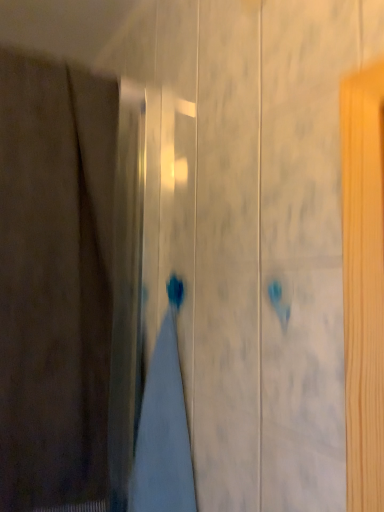
Question: Does brown fabric curtain at left touch gray cotton bath towel at center?

Choices:
 (A) no
 (B) yes

Answer: (A)

Question: Considering the relative sizes of brown fabric curtain at left and gray cotton bath towel at center in the image provided, is brown fabric curtain at left bigger than gray cotton bath towel at center?

Choices:
 (A) no
 (B) yes

Answer: (B)

Question: Is brown fabric curtain at left behind gray cotton bath towel at center?

Choices:
 (A) yes
 (B) no

Answer: (B)

Question: Considering the relative sizes of brown fabric curtain at left and gray cotton bath towel at center in the image provided, is brown fabric curtain at left taller than gray cotton bath towel at center?

Choices:
 (A) no
 (B) yes

Answer: (B)

Question: Can you confirm if brown fabric curtain at left is positioned to the left of gray cotton bath towel at center?

Choices:
 (A) no
 (B) yes

Answer: (B)

Question: Could you tell me if brown fabric curtain at left is turned towards gray cotton bath towel at center?

Choices:
 (A) no
 (B) yes

Answer: (A)

Question: Can you confirm if gray cotton bath towel at center is bigger than brown fabric curtain at left?

Choices:
 (A) no
 (B) yes

Answer: (A)

Question: From a real-world perspective, is gray cotton bath towel at center beneath brown fabric curtain at left?

Choices:
 (A) no
 (B) yes

Answer: (B)

Question: Can you confirm if gray cotton bath towel at center is smaller than brown fabric curtain at left?

Choices:
 (A) yes
 (B) no

Answer: (A)

Question: From the image's perspective, is gray cotton bath towel at center under brown fabric curtain at left?

Choices:
 (A) no
 (B) yes

Answer: (B)

Question: Is the depth of gray cotton bath towel at center greater than that of brown fabric curtain at left?

Choices:
 (A) yes
 (B) no

Answer: (A)

Question: Is gray cotton bath towel at center to the left of brown fabric curtain at left from the viewer's perspective?

Choices:
 (A) no
 (B) yes

Answer: (A)

Question: Looking at the image, does brown fabric curtain at left seem bigger or smaller compared to gray cotton bath towel at center?

Choices:
 (A) small
 (B) big

Answer: (B)